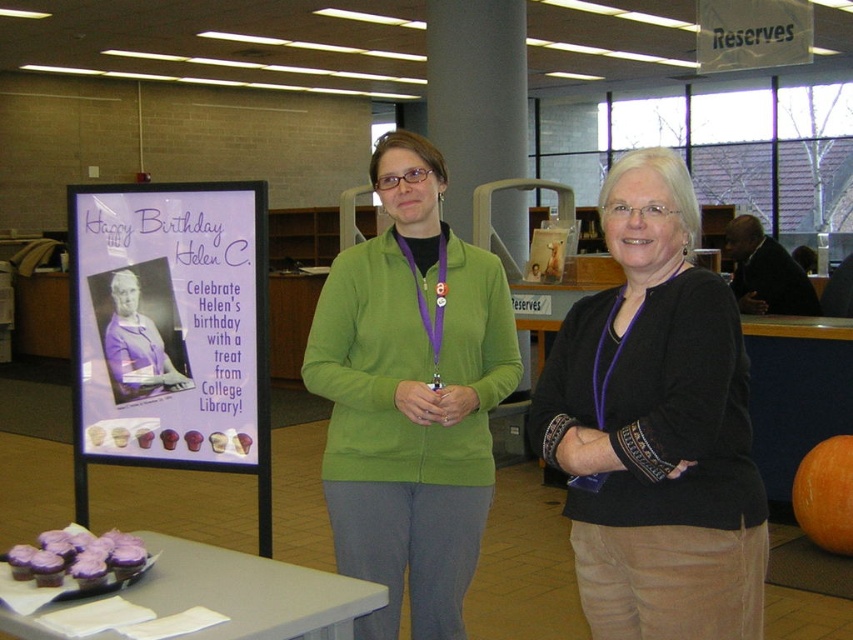
You are a guest at a birthday party in a library. You see a table with a sign that says Happy Birthday Helen C. and a photo of a. There is also a point marked at coordinate (248, 593). What is located at that point?

The point at coordinate (248, 593) has purple frosted cupcakes at lower left.

You are a guest at a birthday celebration in a library. You see a dark brown leather jacket at upper right and a purple fabric at center. Which object is taller?

The dark brown leather jacket at upper right is taller than the purple fabric at center.

You are a guest at a birthday party in a library. You see the purple frosted cupcakes at lower left and the purple frosted cupcake at lower left. Which one is taller?

The purple frosted cupcakes at lower left is taller than the purple frosted cupcake at lower left.